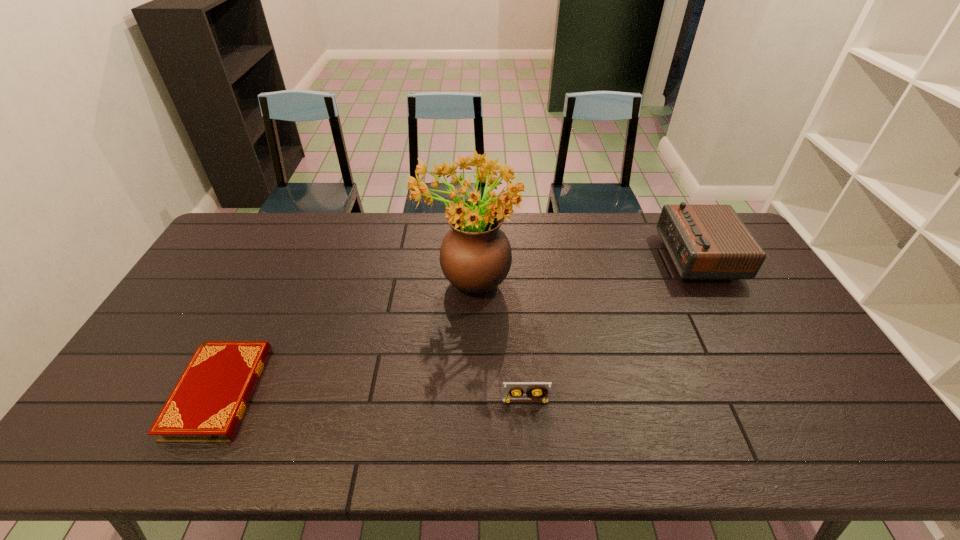
Find the location of a particular element. This screenshot has height=540, width=960. flower arrangement is located at coordinates (475, 256).

Locate an element on the screen. the second tallest object is located at coordinates (705, 242).

This screenshot has height=540, width=960. Identify the location of radio receiver. (705, 242).

This screenshot has width=960, height=540. Identify the location of videotape. (536, 391).

The height and width of the screenshot is (540, 960). In order to click on hardback book in this screenshot , I will do `click(207, 404)`.

I want to click on the shortest object, so click(207, 404).

Where is `vacant area located 0.330m on the right of the tallest object`? Image resolution: width=960 pixels, height=540 pixels. vacant area located 0.330m on the right of the tallest object is located at coordinates (619, 279).

Locate an element on the screen. The image size is (960, 540). blank space located 0.330m on the front panel of the radio receiver is located at coordinates (569, 256).

What are the coordinates of `vacant space positioned 0.190m on the front panel of the radio receiver` in the screenshot? It's located at (610, 256).

Image resolution: width=960 pixels, height=540 pixels. I want to click on free space located on the front panel of the radio receiver, so click(x=558, y=256).